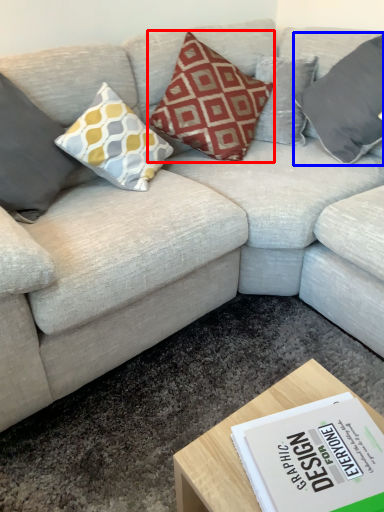
Question: Which point is further to the camera, pillow (highlighted by a red box) or pillow (highlighted by a blue box)?

Choices:
 (A) pillow
 (B) pillow

Answer: (B)